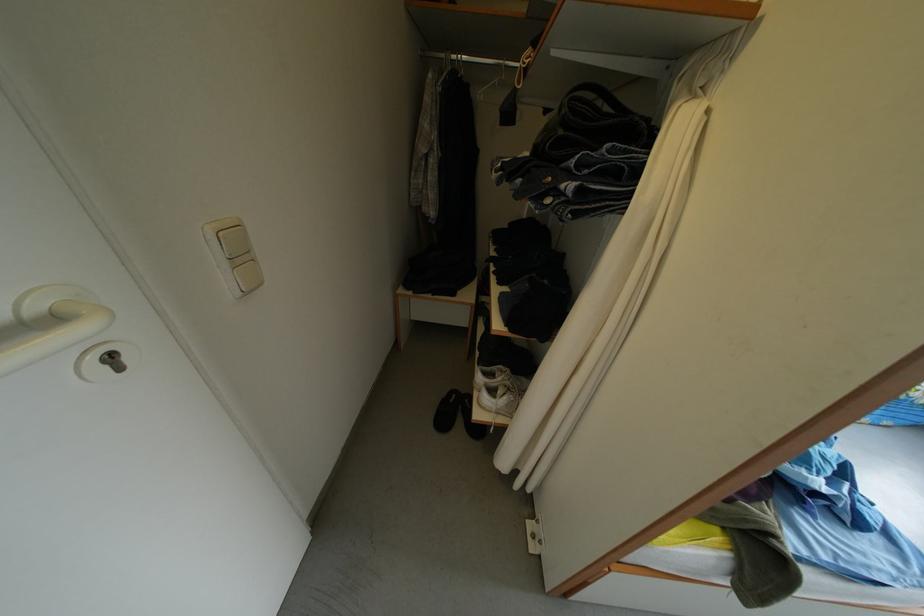
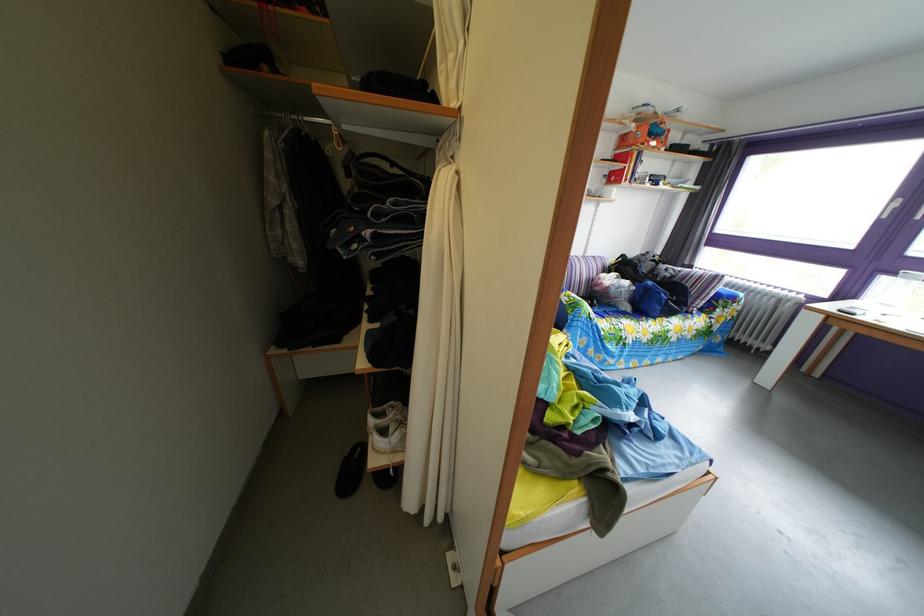
In a continuous first-person perspective shot, in which direction is the camera moving?

The cameraman moved toward right, backward.